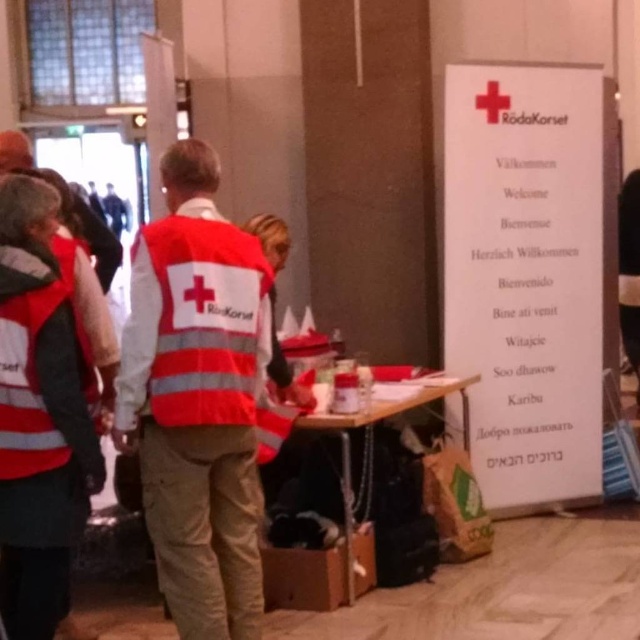
Question: Does reflective white safety vest at center appear under wooden table at center?

Choices:
 (A) yes
 (B) no

Answer: (B)

Question: Is reflective white safety vest at center smaller than wooden table at center?

Choices:
 (A) yes
 (B) no

Answer: (A)

Question: Estimate the real-world distances between objects in this image. Which object is farther from the wooden table at center?

Choices:
 (A) reflective silver vest at left
 (B) reflective orange vest at center

Answer: (A)

Question: Estimate the real-world distances between objects in this image. Which object is farther from the wooden table at center?

Choices:
 (A) reflective silver vest at left
 (B) reflective orange safety vest at left

Answer: (A)

Question: Among these objects, which one is farthest from the camera?

Choices:
 (A) wooden table at center
 (B) reflective orange vest at center
 (C) reflective white safety vest at center
 (D) reflective orange safety vest at left

Answer: (A)

Question: Considering the relative positions of reflective orange vest at center and reflective white safety vest at center in the image provided, where is reflective orange vest at center located with respect to reflective white safety vest at center?

Choices:
 (A) above
 (B) below

Answer: (B)